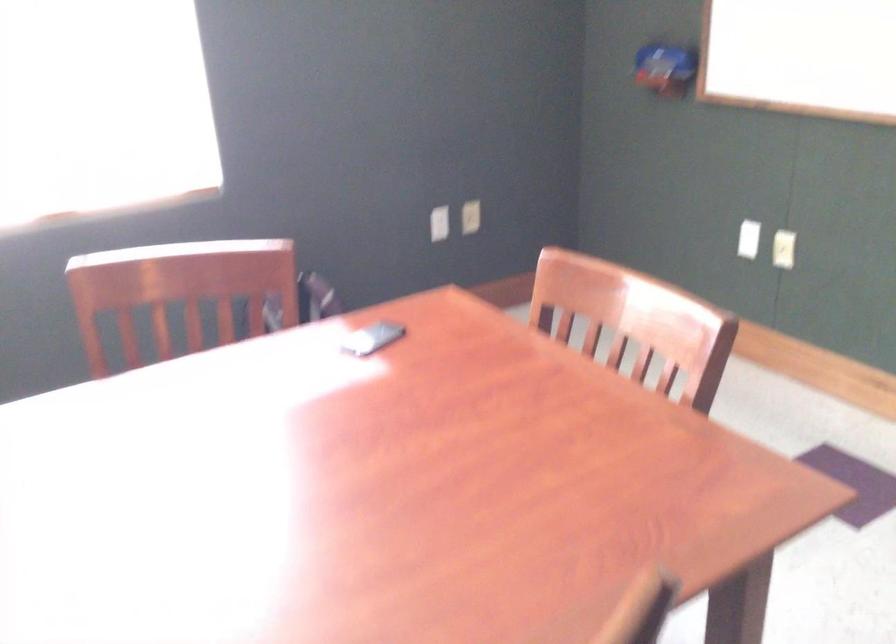
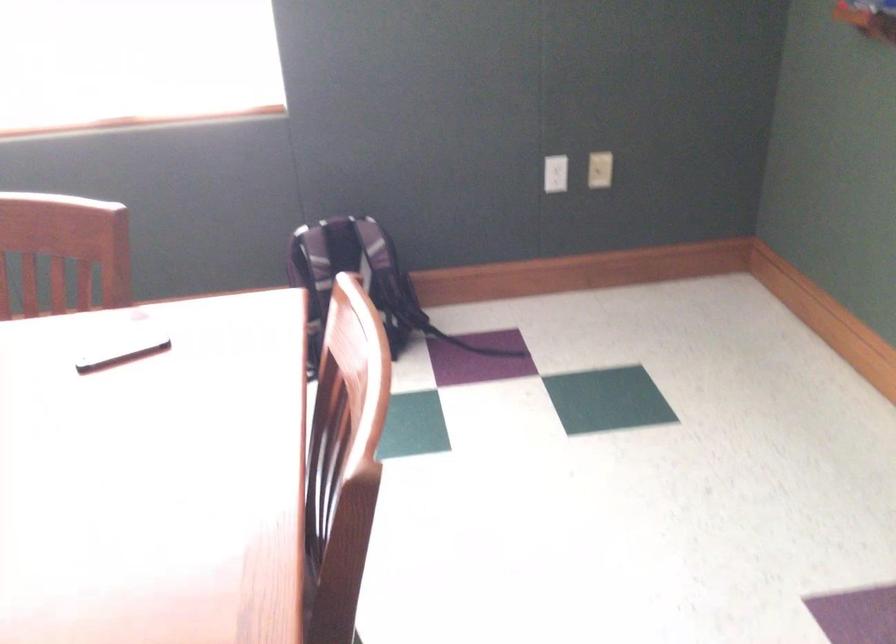
Which direction would the cameraman need to move to produce the second image?

The cameraman walked toward right, forward.